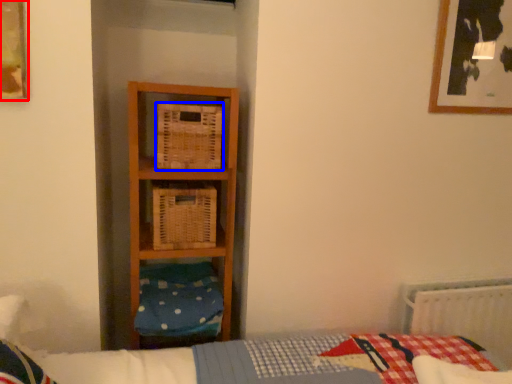
Question: Which object appears farthest to the camera in this image, picture frame (highlighted by a red box) or crate (highlighted by a blue box)?

Choices:
 (A) picture frame
 (B) crate

Answer: (B)